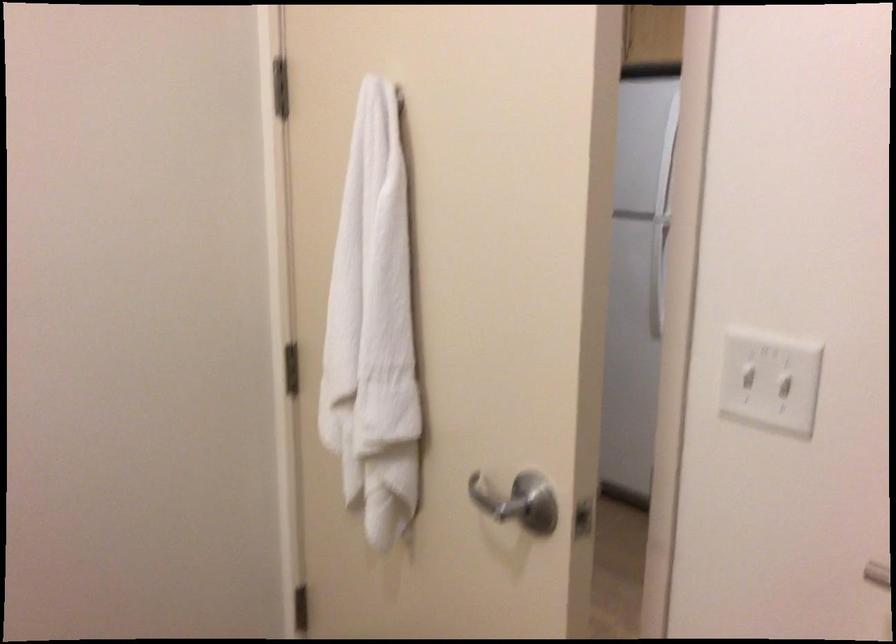
First-person continuous shooting, in which direction is the camera rotating?

The rotation direction of the camera is left-down.